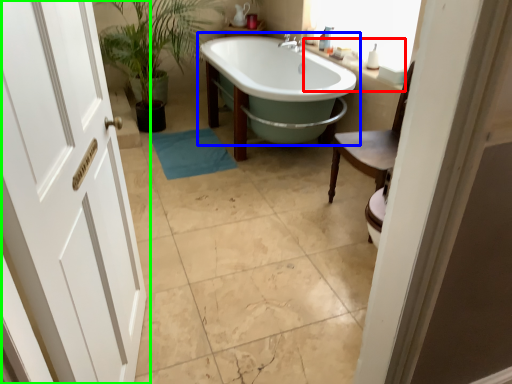
Question: Which is nearer to the counter top (highlighted by a red box)? bathtub (highlighted by a blue box) or door (highlighted by a green box).

Choices:
 (A) bathtub
 (B) door

Answer: (A)